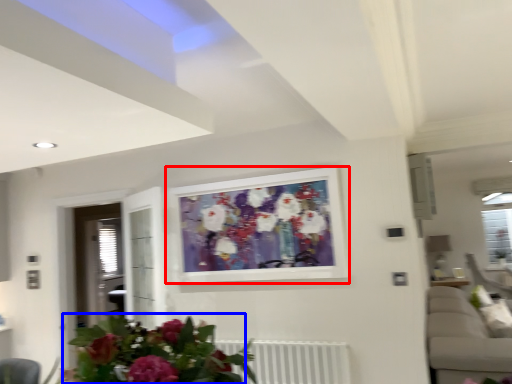
Question: Which point is further to the camera, picture frame (highlighted by a red box) or floral arrangement (highlighted by a blue box)?

Choices:
 (A) picture frame
 (B) floral arrangement

Answer: (A)